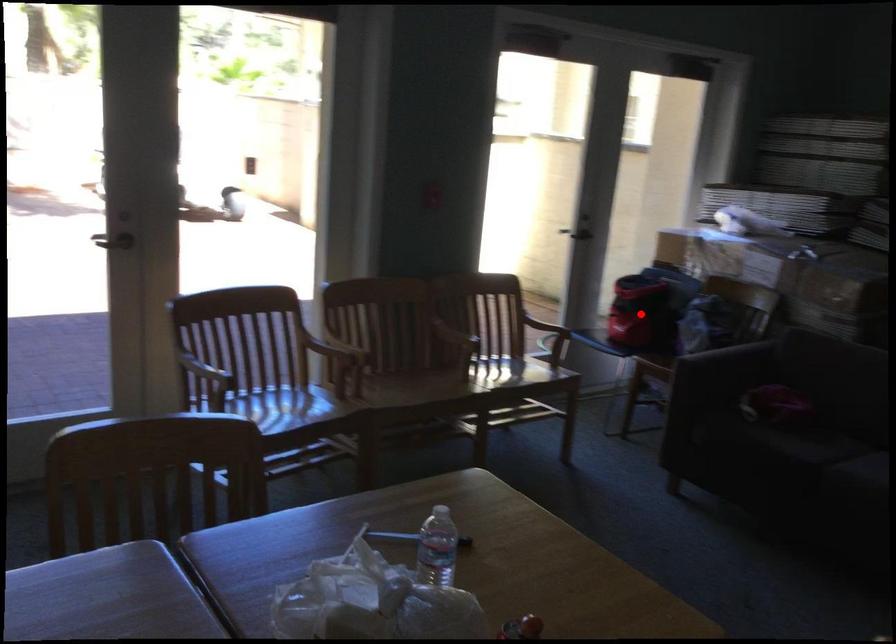
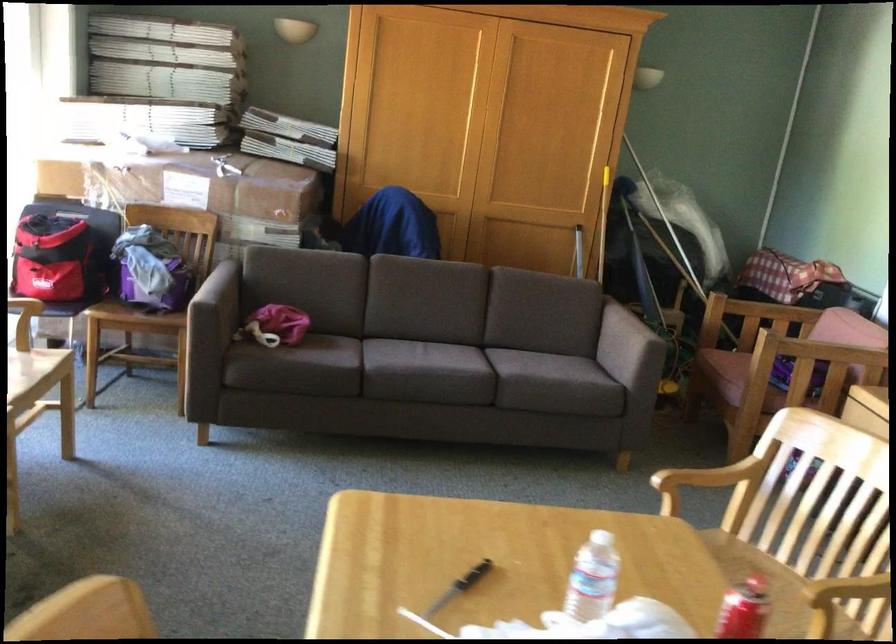
The point at the highlighted location is marked in the first image. Where is the corresponding point in the second image?

(74, 279)